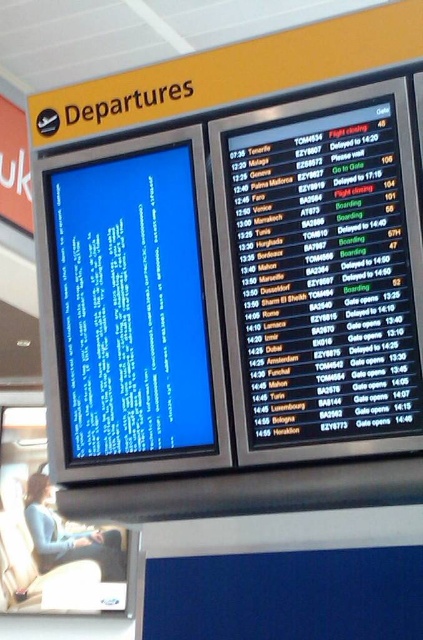
Who is more forward, (x=252, y=189) or (x=189, y=221)?

Point (x=252, y=189) is in front.

Where is `black glossy departure board at upper right`? black glossy departure board at upper right is located at coordinates (323, 273).

Find the location of a particular element. Image resolution: width=423 pixels, height=640 pixels. black glossy departure board at upper right is located at coordinates [x=323, y=273].

I want to click on black glossy departure board at upper right, so click(323, 273).